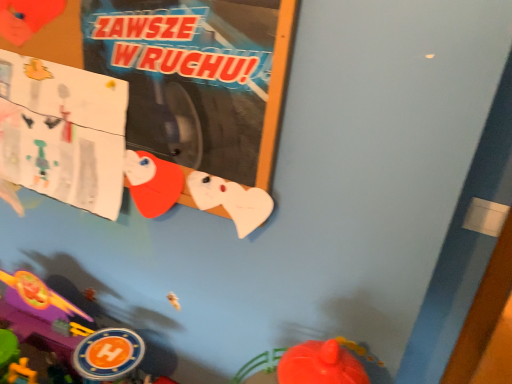
Question: Considering their positions, is white paper at upper left located in front of or behind smooth plastic toy at lower left?

Choices:
 (A) front
 (B) behind

Answer: (B)

Question: Is white paper at upper left taller or shorter than smooth plastic toy at lower left?

Choices:
 (A) short
 (B) tall

Answer: (A)

Question: Based on their sizes in the image, would you say white paper at upper left is bigger or smaller than smooth plastic toy at lower left?

Choices:
 (A) big
 (B) small

Answer: (B)

Question: Considering their positions, is smooth plastic toy at lower left located in front of or behind white paper at upper left?

Choices:
 (A) behind
 (B) front

Answer: (B)

Question: Is smooth plastic toy at lower left situated inside white paper at upper left or outside?

Choices:
 (A) inside
 (B) outside

Answer: (B)

Question: From their relative heights in the image, would you say smooth plastic toy at lower left is taller or shorter than white paper at upper left?

Choices:
 (A) tall
 (B) short

Answer: (A)

Question: From the image's perspective, is smooth plastic toy at lower left above or below white paper at upper left?

Choices:
 (A) below
 (B) above

Answer: (A)